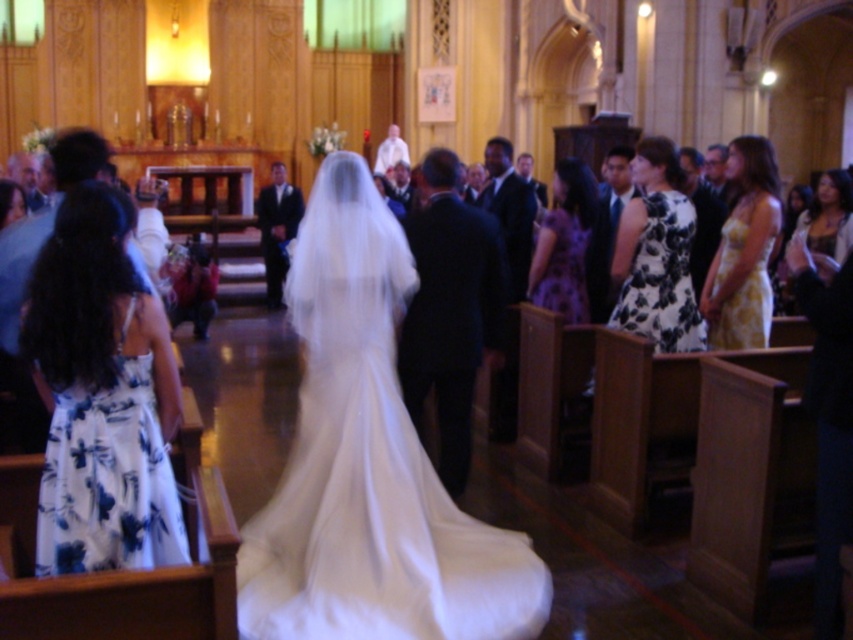
You are standing at the entrance of the church and looking towards the altar. There are two points marked in the image, point (663, 236) and point (583, 198). Which point is closer to you?

Point (663, 236) is closer to the camera than point (583, 198).

You are a photographer positioned at the front of the church during the wedding. You need to capture a closeup shot of both the black floral dress at center and the purple satin dress at center. Which dress will appear bigger in the photo?

The black floral dress at center will appear bigger in the photo because it has a larger size compared to the purple satin dress at center.

You are a photographer positioned at the back of the church, aiming to capture a clear shot of both the black floral dress at center and the matte gold necklace at upper right. Considering their positions and sizes, which object might appear smaller in your photo?

The black floral dress at center appears smaller in the photo because it has a lesser height compared to the matte gold necklace at upper right.